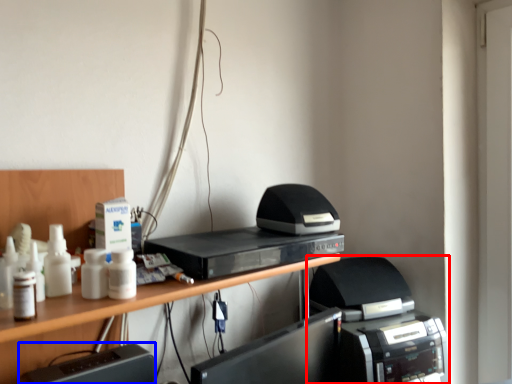
Question: Which object appears closest to the camera in this image, printer (highlighted by a red box) or register (highlighted by a blue box)?

Choices:
 (A) printer
 (B) register

Answer: (B)